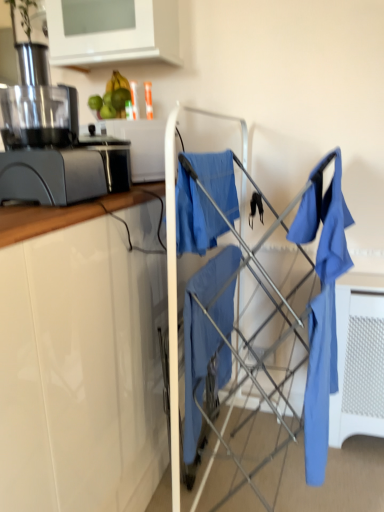
Question: Does matte blue shirt at right have a lesser width compared to white glossy cabinet at upper left?

Choices:
 (A) no
 (B) yes

Answer: (B)

Question: Does matte blue shirt at right have a greater height compared to white glossy cabinet at upper left?

Choices:
 (A) no
 (B) yes

Answer: (B)

Question: Is matte blue shirt at right to the left of white glossy cabinet at upper left from the viewer's perspective?

Choices:
 (A) yes
 (B) no

Answer: (B)

Question: Is matte blue shirt at right placed right next to white glossy cabinet at upper left?

Choices:
 (A) no
 (B) yes

Answer: (A)

Question: Can you confirm if matte blue shirt at right is smaller than white glossy cabinet at upper left?

Choices:
 (A) yes
 (B) no

Answer: (A)

Question: Is matte blue shirt at right wider than white glossy cabinet at upper left?

Choices:
 (A) no
 (B) yes

Answer: (A)

Question: Does white glossy cabinet at upper left appear on the left side of matte blue fabric at center?

Choices:
 (A) yes
 (B) no

Answer: (A)

Question: Is white glossy cabinet at upper left positioned with its back to matte blue fabric at center?

Choices:
 (A) no
 (B) yes

Answer: (A)

Question: Is white glossy cabinet at upper left shorter than matte blue fabric at center?

Choices:
 (A) yes
 (B) no

Answer: (A)

Question: Is white glossy cabinet at upper left positioned far away from matte blue fabric at center?

Choices:
 (A) yes
 (B) no

Answer: (B)

Question: Is matte blue fabric at center completely or partially inside white glossy cabinet at upper left?

Choices:
 (A) yes
 (B) no

Answer: (B)

Question: Would you say white glossy cabinet at upper left is outside matte blue fabric at center?

Choices:
 (A) yes
 (B) no

Answer: (A)

Question: From the image's perspective, would you say matte blue fabric at center is positioned over white glossy cabinet at upper left?

Choices:
 (A) yes
 (B) no

Answer: (B)